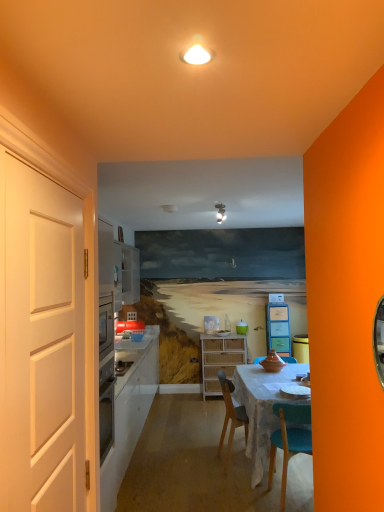
Question: In the image, is white matte door at left positioned in front of or behind matte white light fixture at upper center?

Choices:
 (A) behind
 (B) front

Answer: (B)

Question: Considering the positions of point (51, 268) and point (216, 203), is point (51, 268) closer or farther from the camera than point (216, 203)?

Choices:
 (A) farther
 (B) closer

Answer: (B)

Question: Estimate the real-world distances between objects in this image. Which object is farther from the matte plastic cabinet at center, which is counted as the second cabinetry, starting from the left?

Choices:
 (A) white matte door at left
 (B) woven wood cabinet at center, the first cabinetry viewed from the left
 (C) matte white light fixture at upper center

Answer: (A)

Question: Considering the real-world distances, which object is farthest from the white matte door at left?

Choices:
 (A) matte plastic cabinet at center, which is counted as the second cabinetry, starting from the left
 (B) matte white light fixture at upper center
 (C) woven wood cabinet at center, the first cabinetry viewed from the left

Answer: (A)